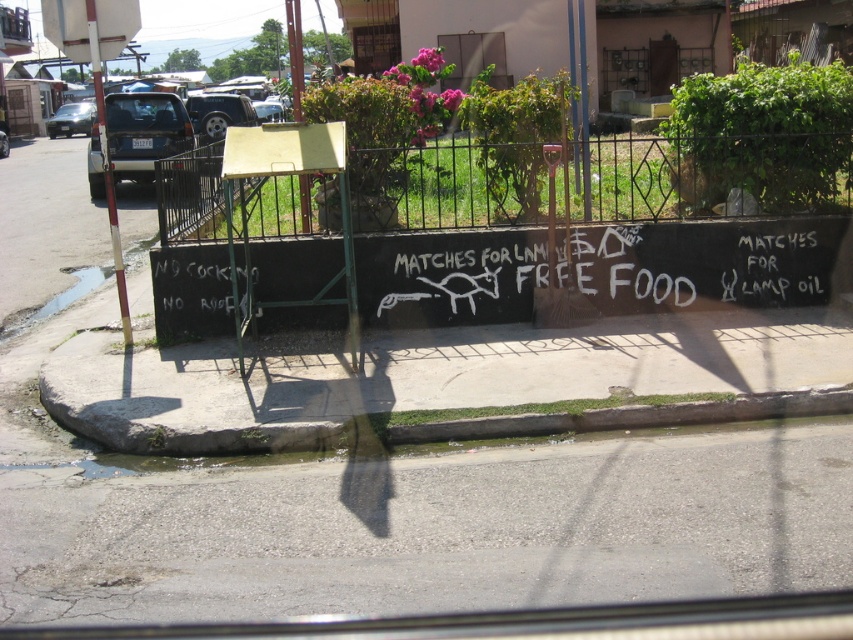
Question: Which object is farther from the camera taking this photo?

Choices:
 (A) matte black suv at upper left
 (B) metallic wire fence at center

Answer: (A)

Question: Which point appears closest to the camera in this image?

Choices:
 (A) (583, 422)
 (B) (540, 268)
 (C) (219, 124)
 (D) (64, 129)

Answer: (A)

Question: Does gray concrete curb at lower center appear over white chalk writing at lower left?

Choices:
 (A) no
 (B) yes

Answer: (A)

Question: Is matte blue suv at left to the left of white chalk writing at lower left from the viewer's perspective?

Choices:
 (A) yes
 (B) no

Answer: (A)

Question: Among these points, which one is farthest from the camera?

Choices:
 (A) (172, 314)
 (B) (55, 115)

Answer: (B)

Question: Does white chalk writing at lower left have a lesser width compared to matte black suv at upper left?

Choices:
 (A) yes
 (B) no

Answer: (A)